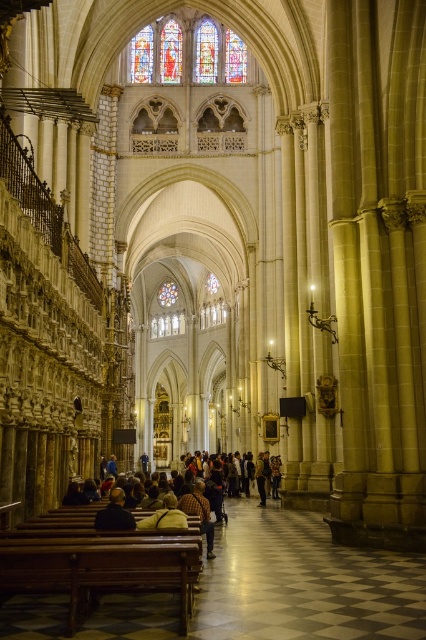
Question: Is stained glass window at upper center bigger than leather jacket at center?

Choices:
 (A) yes
 (B) no

Answer: (A)

Question: Does stained glass window at upper center have a smaller size compared to leather jacket at center?

Choices:
 (A) yes
 (B) no

Answer: (B)

Question: Which of the following is the closest to the observer?

Choices:
 (A) brown polished wood bench at lower left
 (B) leather jacket at center

Answer: (A)

Question: Which object is farther from the camera taking this photo?

Choices:
 (A) stained glass window at upper center
 (B) dark brown leather jacket at lower left
 (C) checkered fabric shirt at center

Answer: (A)

Question: Estimate the real-world distances between objects in this image. Which object is closer to the dark brown leather jacket at lower left?

Choices:
 (A) dark brown leather jacket at center
 (B) leather jacket at center

Answer: (B)

Question: From the image, what is the correct spatial relationship of dark brown leather jacket at lower left in relation to checkered fabric shirt at center?

Choices:
 (A) left
 (B) right

Answer: (B)